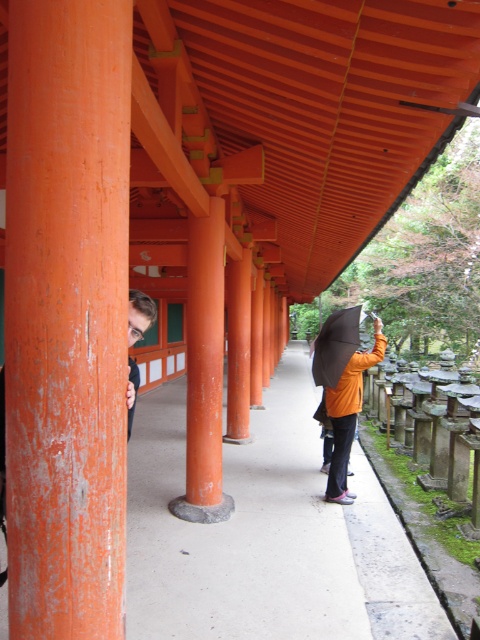
Question: Which point is farther to the camera?

Choices:
 (A) (12, 28)
 (B) (324, 342)
 (C) (343, 420)
 (D) (358, 508)

Answer: (B)

Question: Which is farther from the black matte umbrella at center?

Choices:
 (A) matte orange hair at left
 (B) orange matte jacket at center
 (C) smooth concrete path at center

Answer: (A)

Question: Can you confirm if smooth orange wood pillar at left is wider than matte orange hair at left?

Choices:
 (A) no
 (B) yes

Answer: (B)

Question: Which of the following is the closest to the observer?

Choices:
 (A) (8, 440)
 (B) (180, 561)

Answer: (A)

Question: Can you confirm if orange matte jacket at center is wider than black matte umbrella at center?

Choices:
 (A) yes
 (B) no

Answer: (A)

Question: Is smooth concrete path at center wider than matte orange hair at left?

Choices:
 (A) no
 (B) yes

Answer: (B)